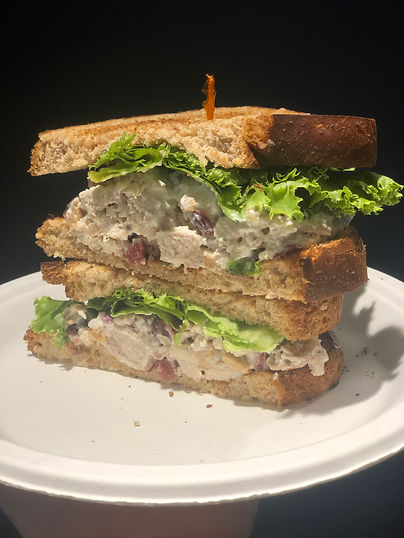
Find the location of a particular element. side edge of plate is located at coordinates (365, 443), (28, 463), (216, 467).